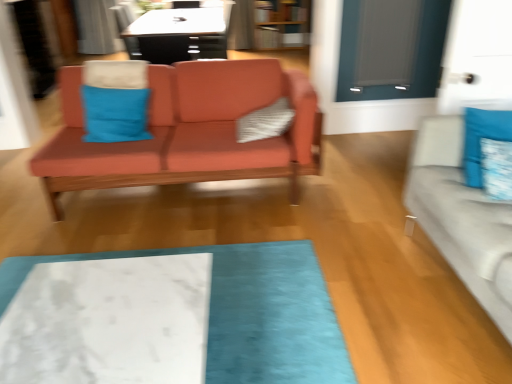
Image resolution: width=512 pixels, height=384 pixels. What do you see at coordinates (281, 24) in the screenshot?
I see `wooden bookshelf at upper center` at bounding box center [281, 24].

Image resolution: width=512 pixels, height=384 pixels. Describe the element at coordinates (497, 168) in the screenshot. I see `blue fabric pillow at right, the 3th pillow when ordered from left to right` at that location.

Find the location of a particular element. white textured pillow at center, marked as the 2th pillow in a left-to-right arrangement is located at coordinates (265, 122).

Measure the distance between point [259,139] and camera.

Point [259,139] and camera are 2.53 meters apart from each other.

At what (x,y) coordinates should I click in order to perform the action: click on blue fabric pillow at center, which ranks as the 4th pillow in right-to-left order. Please return your answer as a coordinate pair (x, y). Image resolution: width=512 pixels, height=384 pixels. Looking at the image, I should click on tap(115, 114).

Is white textured pillow at center, the 3th pillow in the right-to-left sequence, to the left of white marble mat at lower center from the viewer's perspective?

No.

Considering the relative sizes of white textured pillow at center, marked as the 2th pillow in a left-to-right arrangement, and white marble mat at lower center in the image provided, is white textured pillow at center, marked as the 2th pillow in a left-to-right arrangement, wider than white marble mat at lower center?

No.

In the image, is matte gray glass door at upper right on the left side or the right side of blue fabric pillow at center, which ranks as the 4th pillow in right-to-left order?

Clearly, matte gray glass door at upper right is on the right of blue fabric pillow at center, which ranks as the 4th pillow in right-to-left order, in the image.

From a real-world perspective, which object stands above the other?

matte gray glass door at upper right, from a real-world perspective.

Is matte gray glass door at upper right smaller than blue fabric pillow at center, which ranks as the 4th pillow in right-to-left order?

Yes, matte gray glass door at upper right is smaller than blue fabric pillow at center, which ranks as the 4th pillow in right-to-left order.

Considering the sizes of matte gray glass door at upper right and blue fabric pillow at center, which is the 1th pillow in left-to-right order, in the image, is matte gray glass door at upper right taller or shorter than blue fabric pillow at center, which is the 1th pillow in left-to-right order,?

In the image, matte gray glass door at upper right appears to be taller than blue fabric pillow at center, which is the 1th pillow in left-to-right order.

Considering the sizes of objects wooden bookshelf at upper center and blue fabric pillow at right, the 3th pillow when ordered from left to right, in the image provided, who is taller, wooden bookshelf at upper center or blue fabric pillow at right, the 3th pillow when ordered from left to right,?

With more height is wooden bookshelf at upper center.

Which object is wider, wooden bookshelf at upper center or blue fabric pillow at right, the 3th pillow when ordered from left to right?

Wider between the two is wooden bookshelf at upper center.

Does wooden bookshelf at upper center touch blue fabric pillow at right, the 2th pillow in the right-to-left sequence?

No, wooden bookshelf at upper center is not next to blue fabric pillow at right, the 2th pillow in the right-to-left sequence.

Can you confirm if wooden bookshelf at upper center is bigger than blue fabric pillow at right, the 2th pillow in the right-to-left sequence?

Indeed, wooden bookshelf at upper center has a larger size compared to blue fabric pillow at right, the 2th pillow in the right-to-left sequence.

Between light gray fabric couch at right, which is the 2th studio couch in back-to-front order, and blue fabric pillow at right, which is the 4th pillow from left to right, which one is positioned in front?

light gray fabric couch at right, which is the 2th studio couch in back-to-front order, is more forward.

Based on the photo, does light gray fabric couch at right, which is the 1th studio couch from front to back, appear on the left side of blue fabric pillow at right, arranged as the first pillow when viewed from the right?

No, light gray fabric couch at right, which is the 1th studio couch from front to back, is not to the left of blue fabric pillow at right, arranged as the first pillow when viewed from the right.

Is light gray fabric couch at right, which is the 1th studio couch from front to back, positioned far away from blue fabric pillow at right, which is the 4th pillow from left to right?

No, light gray fabric couch at right, which is the 1th studio couch from front to back, is not far away from blue fabric pillow at right, which is the 4th pillow from left to right.

Between white marble mat at lower center and blue fabric pillow at center, which is the 1th pillow in left-to-right order, which one is positioned behind?

blue fabric pillow at center, which is the 1th pillow in left-to-right order, is behind.

Is white marble mat at lower center facing away from blue fabric pillow at center, which ranks as the 4th pillow in right-to-left order?

white marble mat at lower center is not turned away from blue fabric pillow at center, which ranks as the 4th pillow in right-to-left order.

Are white marble mat at lower center and blue fabric pillow at center, which ranks as the 4th pillow in right-to-left order, beside each other?

No.

From a real-world perspective, which is physically above, white marble mat at lower center or blue fabric pillow at center, which ranks as the 4th pillow in right-to-left order?

blue fabric pillow at center, which ranks as the 4th pillow in right-to-left order, from a real-world perspective.

Could you tell me if wooden bookshelf at upper center is turned towards white marble mat at lower center?

Yes, wooden bookshelf at upper center is facing white marble mat at lower center.

Does wooden bookshelf at upper center appear on the right side of white marble mat at lower center?

Yes, wooden bookshelf at upper center is to the right of white marble mat at lower center.

Does wooden bookshelf at upper center come in front of white marble mat at lower center?

No, the depth of wooden bookshelf at upper center is greater than that of white marble mat at lower center.

Which of these two, wooden bookshelf at upper center or white marble mat at lower center, is wider?

With larger width is white marble mat at lower center.

Choose the correct answer: Is white textured pillow at center, the 3th pillow in the right-to-left sequence, inside matte coral couch at center, the 2th studio couch in the right-to-left sequence, or outside it?

white textured pillow at center, the 3th pillow in the right-to-left sequence, is spatially positioned inside matte coral couch at center, the 2th studio couch in the right-to-left sequence.

How different are the orientations of white textured pillow at center, marked as the 2th pillow in a left-to-right arrangement, and matte coral couch at center, which is the first studio couch from left to right, in degrees?

They differ by 88.9 degrees in their facing directions.

Between white textured pillow at center, the 3th pillow in the right-to-left sequence, and matte coral couch at center, the 1th studio couch positioned from the back, which one has more height?

matte coral couch at center, the 1th studio couch positioned from the back, is taller.

Which object is more forward, white textured pillow at center, marked as the 2th pillow in a left-to-right arrangement, or matte coral couch at center, the 1th studio couch positioned from the back?

matte coral couch at center, the 1th studio couch positioned from the back, is more forward.

From a real-world perspective, which pillow is the 1st one above the white marble mat at lower center? Please provide its 2D coordinates.

[(265, 122)]

From the image's perspective, which pillow is the 1st one below the matte gray glass door at upper right? Please provide its 2D coordinates.

[(115, 114)]

Consider the image. Which object lies further to the anchor point matte gray glass door at upper right, light gray fabric couch at right, the 2th studio couch from the left, or wooden bookshelf at upper center?

light gray fabric couch at right, the 2th studio couch from the left, is positioned further to the anchor matte gray glass door at upper right.

Looking at the image, which one is located further to wooden bookshelf at upper center, light gray fabric couch at right, which is the 1th studio couch from front to back, or blue fabric pillow at right, arranged as the first pillow when viewed from the right?

Based on the image, light gray fabric couch at right, which is the 1th studio couch from front to back, appears to be further to wooden bookshelf at upper center.

In the scene shown: From the image, which object appears to be nearer to light gray fabric couch at right, which is the 2th studio couch in back-to-front order, white marble mat at lower center or matte gray glass door at upper right?

white marble mat at lower center lies closer to light gray fabric couch at right, which is the 2th studio couch in back-to-front order, than the other object.

When comparing their distances from matte gray glass door at upper right, does blue fabric pillow at right, which is the 4th pillow from left to right, or light gray fabric couch at right, which is the 2th studio couch in back-to-front order, seem further?

Based on the image, light gray fabric couch at right, which is the 2th studio couch in back-to-front order, appears to be further to matte gray glass door at upper right.

Which object lies nearer to the anchor point white marble mat at lower center, wooden bookshelf at upper center or light gray fabric couch at right, which is the 2th studio couch in back-to-front order?

light gray fabric couch at right, which is the 2th studio couch in back-to-front order.

Based on their spatial positions, is light gray fabric couch at right, which is the 2th studio couch in back-to-front order, or blue fabric pillow at center, which ranks as the 4th pillow in right-to-left order, further from wooden bookshelf at upper center?

light gray fabric couch at right, which is the 2th studio couch in back-to-front order, is further to wooden bookshelf at upper center.

When comparing their distances from white marble mat at lower center, does matte gray glass door at upper right or matte coral couch at center, which is counted as the second studio couch, starting from the front, seem further?

Based on the image, matte gray glass door at upper right appears to be further to white marble mat at lower center.

When comparing their distances from matte gray glass door at upper right, does blue fabric pillow at right, arranged as the first pillow when viewed from the right, or white marble mat at lower center seem further?

white marble mat at lower center is further to matte gray glass door at upper right.

You are a GUI agent. You are given a task and a screenshot of the screen. Output one action in this format:
    pyautogui.click(x=<x>, y=<y>)
    Task: Click on the studio couch between blue fabric pillow at right, the 3th pillow when ordered from left to right, and wooden bookshelf at upper center from front to back
    
    Given the screenshot: What is the action you would take?
    pyautogui.click(x=188, y=132)

This screenshot has height=384, width=512. Identify the location of studio couch between blue fabric pillow at center, which is the 1th pillow in left-to-right order, and white textured pillow at center, marked as the 2th pillow in a left-to-right arrangement, in the horizontal direction. (188, 132).

This screenshot has width=512, height=384. In order to click on glass door between white textured pillow at center, the 3th pillow in the right-to-left sequence, and wooden bookshelf at upper center from front to back in this screenshot , I will do `click(391, 48)`.

Locate an element on the screen. glass door between blue fabric pillow at right, the 3th pillow when ordered from left to right, and wooden bookshelf at upper center in the front-back direction is located at coordinates (391, 48).